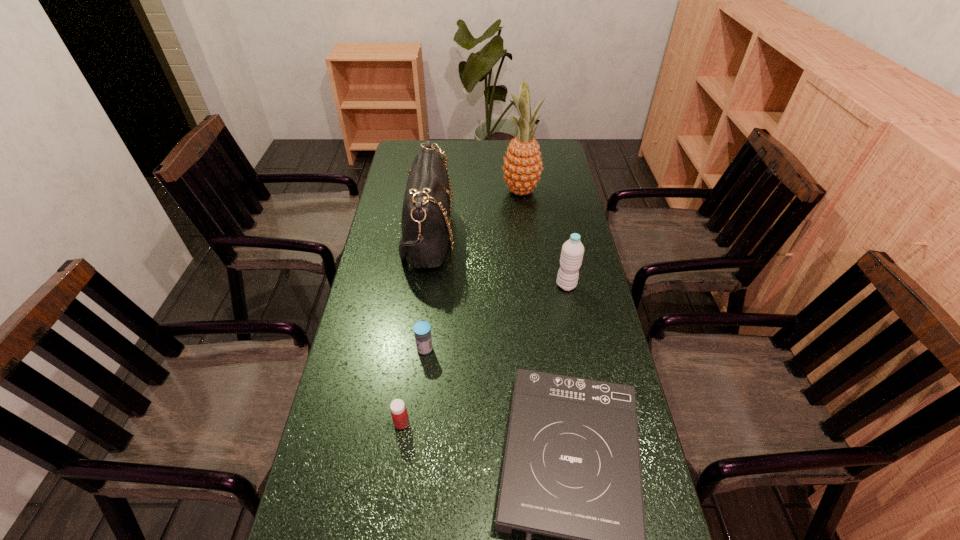
The height and width of the screenshot is (540, 960). I want to click on the tallest object, so click(522, 168).

You are a GUI agent. You are given a task and a screenshot of the screen. Output one action in this format:
    pyautogui.click(x=<x>, y=<y>)
    Task: Click on the handbag
    This screenshot has height=540, width=960.
    Given the screenshot: What is the action you would take?
    pyautogui.click(x=425, y=223)

The image size is (960, 540). Identify the location of water bottle. (572, 252).

You are a GUI agent. You are given a task and a screenshot of the screen. Output one action in this format:
    pyautogui.click(x=<x>, y=<y>)
    Task: Click on the farther medicine
    The height and width of the screenshot is (540, 960).
    Given the screenshot: What is the action you would take?
    pyautogui.click(x=422, y=330)

This screenshot has width=960, height=540. I want to click on the nearer medicine, so click(399, 414).

Find the location of a particular element. This screenshot has width=960, height=540. blank space located 0.150m on the front of the pineapple is located at coordinates (525, 227).

Where is `free space located 0.130m at the front of the fifth shortest object with chain and zipper`? Image resolution: width=960 pixels, height=540 pixels. free space located 0.130m at the front of the fifth shortest object with chain and zipper is located at coordinates (492, 236).

The image size is (960, 540). What are the coordinates of `vacant area located 0.170m on the back of the fourth shortest object` in the screenshot? It's located at (558, 243).

Where is `free space located on the back of the third nearest object`? The height and width of the screenshot is (540, 960). free space located on the back of the third nearest object is located at coordinates (435, 257).

Where is `vacant space located on the right of the nearer medicine`? vacant space located on the right of the nearer medicine is located at coordinates (506, 423).